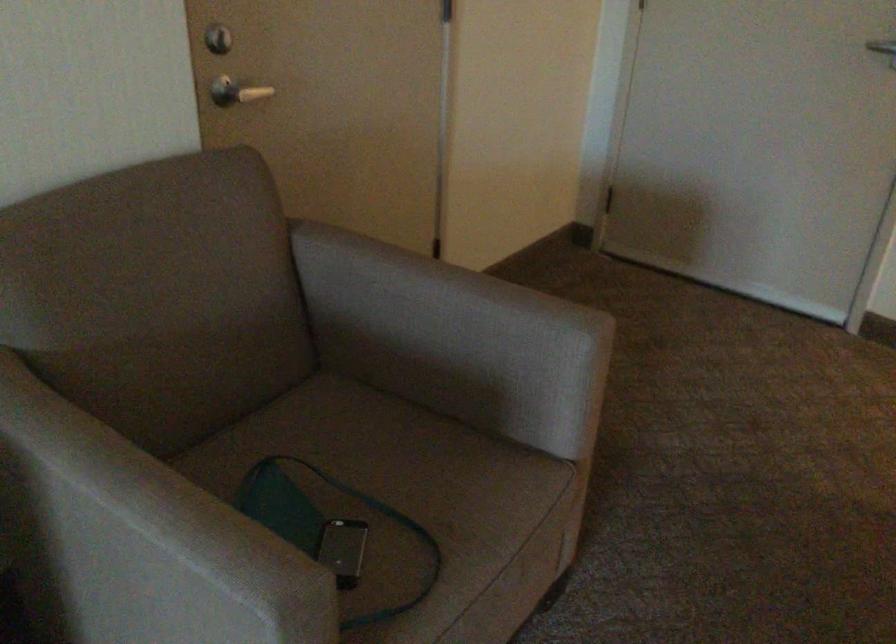
The image size is (896, 644). What do you see at coordinates (236, 91) in the screenshot? I see `the door lock` at bounding box center [236, 91].